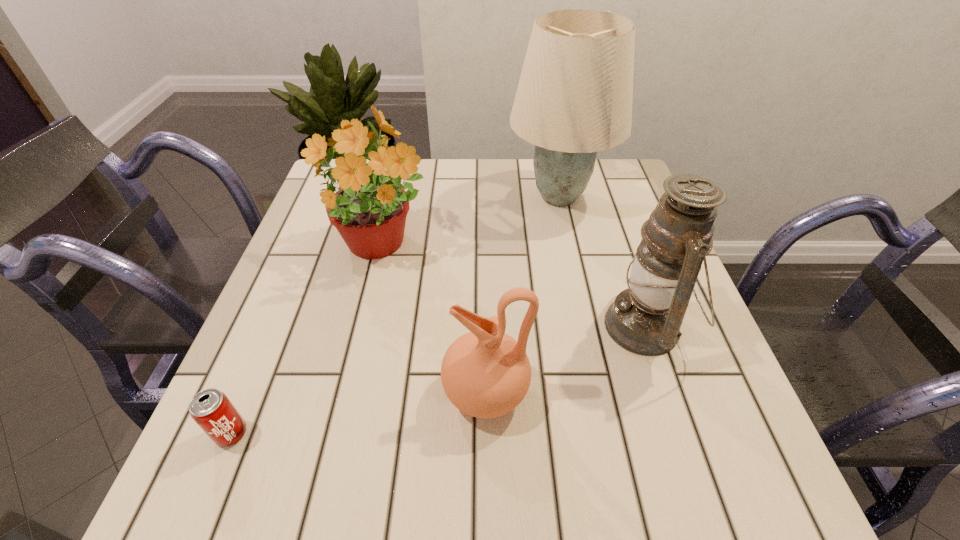
The width and height of the screenshot is (960, 540). In order to click on object at the far right corner in this screenshot , I will do `click(574, 98)`.

Where is `vacant space at the far edge of the desktop`? The width and height of the screenshot is (960, 540). vacant space at the far edge of the desktop is located at coordinates (450, 204).

Identify the location of vacant space at the near edge of the desktop. This screenshot has height=540, width=960. tap(484, 473).

Where is `vacant space at the left edge of the desktop`? Image resolution: width=960 pixels, height=540 pixels. vacant space at the left edge of the desktop is located at coordinates (273, 442).

I want to click on free space at the right edge of the desktop, so click(614, 295).

Find the location of a particular element. free location at the far left corner of the desktop is located at coordinates (324, 185).

Identify the location of blank space at the near left corner. Image resolution: width=960 pixels, height=540 pixels. 228,458.

In the image, there is a desktop. Where is `vacant space at the far right corner`? This screenshot has height=540, width=960. vacant space at the far right corner is located at coordinates [597, 188].

In the image, there is a desktop. Find the location of `free space at the near right corner`. free space at the near right corner is located at coordinates (771, 490).

Locate an element on the screen. free point between the beer can and the pottery is located at coordinates (359, 413).